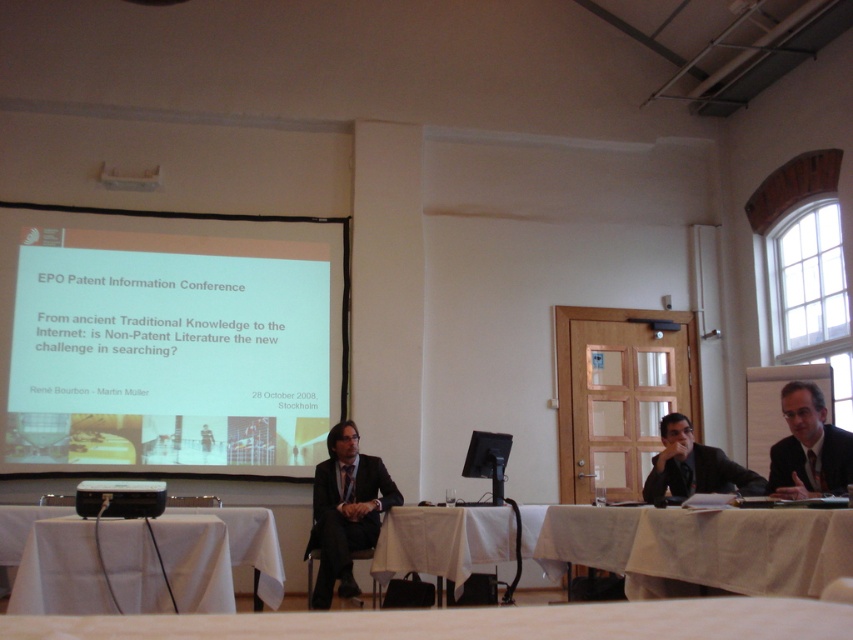
You are attending the EPO Patent Information Conference and need to place a name tag on the table. The conference organizer specified that the name tag should be placed at coordinates between 0.8 and 0.85 on the x and y axes. Where should you place the name tag relative to the white cloth at lower right?

The white cloth at lower right is located at point (x=701, y=548). Since the name tag needs to be placed between 0.8 and 0.85 on both axes, it should be placed slightly to the left and above the white cloth at lower right to meet the required coordinates.